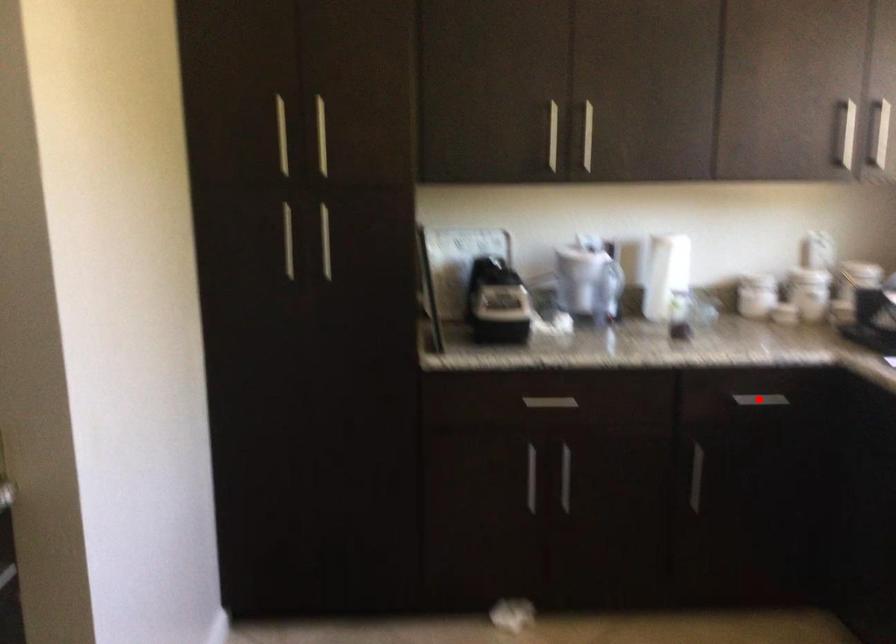
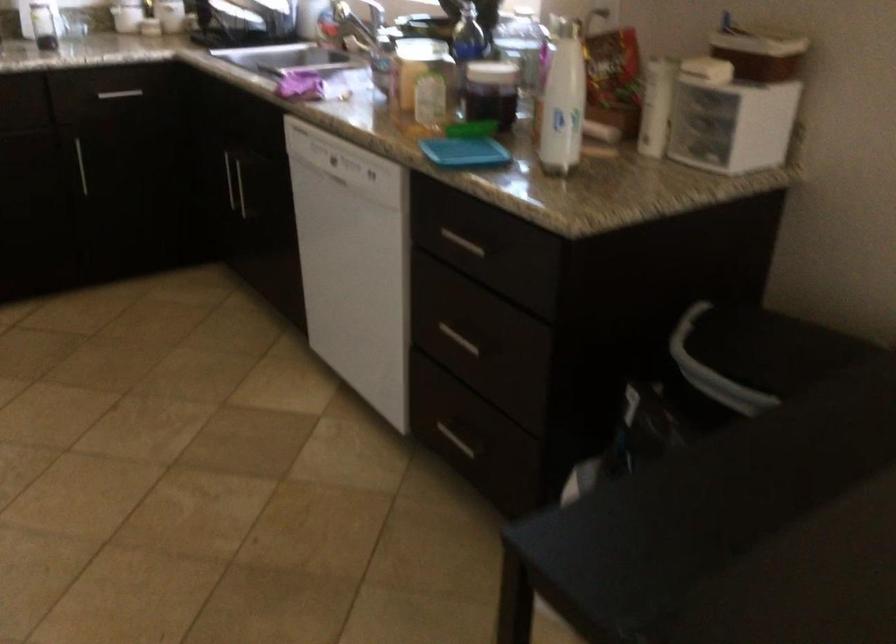
The point at the highlighted location is marked in the first image. Where is the corresponding point in the second image?

(119, 93)